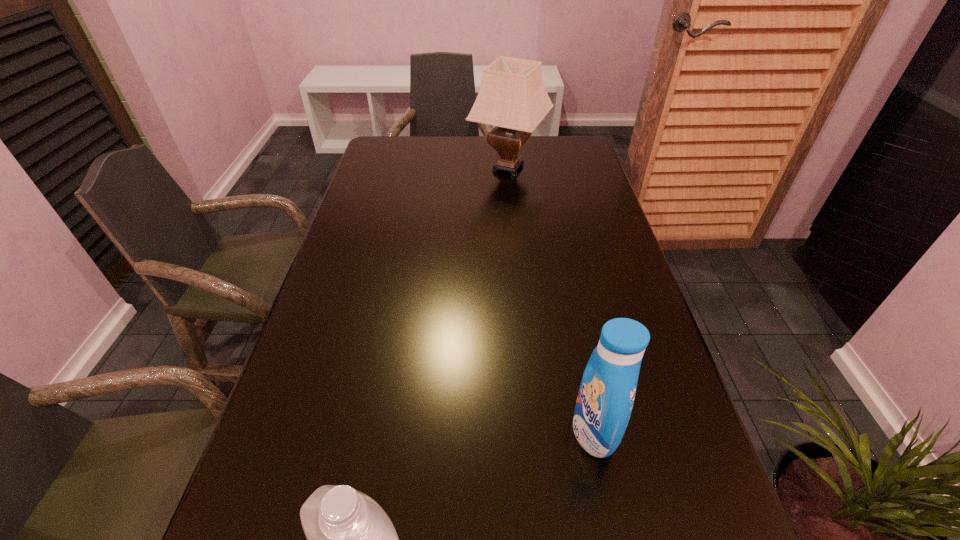
Find the location of a particular element. The image size is (960, 540). detergent located at the right edge is located at coordinates (606, 395).

This screenshot has width=960, height=540. Identify the location of object at the far right corner. point(512,97).

Find the location of a particular element. This screenshot has height=540, width=960. vacant space at the far edge is located at coordinates (431, 151).

Identify the location of vacant position at the left edge of the desktop. (323, 427).

This screenshot has width=960, height=540. Identify the location of free point at the right edge. (588, 244).

Where is `free space at the far right corner of the desktop`? The image size is (960, 540). free space at the far right corner of the desktop is located at coordinates (544, 136).

The height and width of the screenshot is (540, 960). I want to click on blank region between the right detergent and the tallest object, so click(x=551, y=299).

Find the location of `free area in between the lampshade and the second farthest object`. free area in between the lampshade and the second farthest object is located at coordinates (551, 299).

The width and height of the screenshot is (960, 540). What are the coordinates of `blank region between the lampshade and the second nearest object` in the screenshot? It's located at (551, 299).

Where is `object that is the closest one to the farther detergent`? The image size is (960, 540). object that is the closest one to the farther detergent is located at coordinates (350, 539).